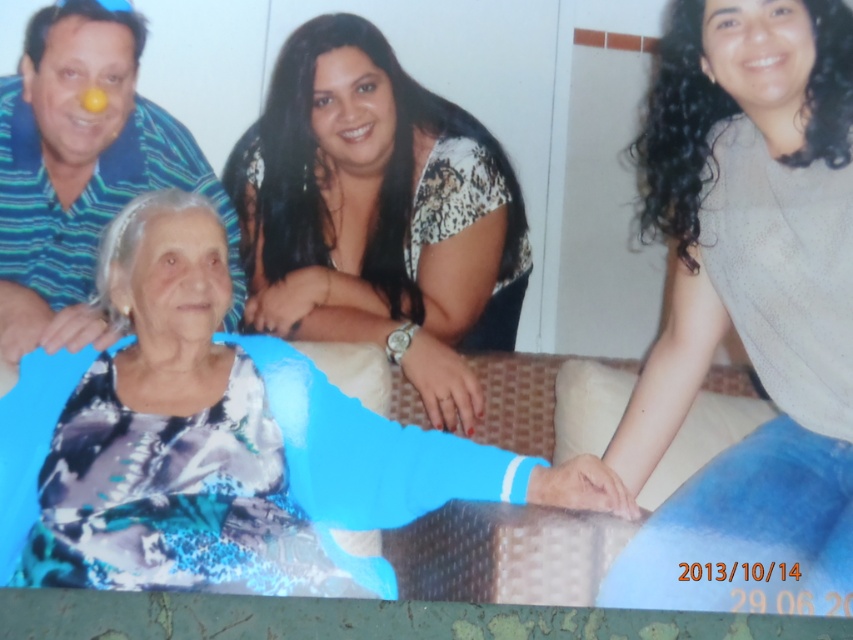
Does printed fabric blouse at center have a greater width compared to blue striped shirt at upper left?

Correct, the width of printed fabric blouse at center exceeds that of blue striped shirt at upper left.

Is printed fabric blouse at center shorter than blue striped shirt at upper left?

No.

Does point (347, 208) come closer to viewer compared to point (67, 326)?

No, it is not.

I want to click on printed fabric blouse at center, so click(379, 214).

Can you confirm if blue textured sweater at center is thinner than printed fabric blouse at center?

Indeed, blue textured sweater at center has a lesser width compared to printed fabric blouse at center.

Does blue textured sweater at center appear on the left side of printed fabric blouse at center?

No, blue textured sweater at center is not to the left of printed fabric blouse at center.

Find the location of `blue textured sweater at center`. blue textured sweater at center is located at coordinates (747, 308).

Which is more to the right, blue textured sweater at center or blue striped shirt at upper left?

From the viewer's perspective, blue textured sweater at center appears more on the right side.

What do you see at coordinates (747, 308) in the screenshot? This screenshot has height=640, width=853. I see `blue textured sweater at center` at bounding box center [747, 308].

Locate an element on the screen. blue textured sweater at center is located at coordinates tap(747, 308).